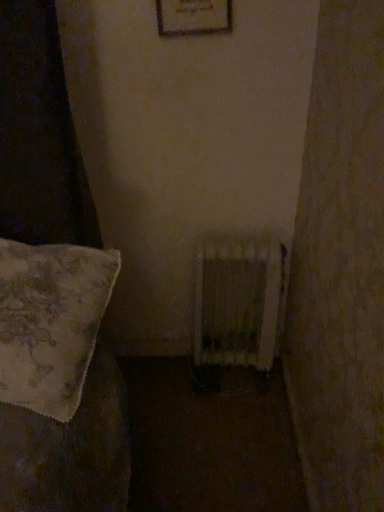
This screenshot has height=512, width=384. What do you see at coordinates (59, 383) in the screenshot? I see `floral fabric pillow at left` at bounding box center [59, 383].

This screenshot has width=384, height=512. Identify the location of wooden framed picture at upper center. (193, 17).

Based on the photo, what is the approximate width of wooden framed picture at upper center?

wooden framed picture at upper center is 3.69 centimeters in width.

Describe the element at coordinates (237, 301) in the screenshot. I see `wooden radiator at center` at that location.

Locate an element on the screen. This screenshot has height=512, width=384. floral fabric pillow at left is located at coordinates (59, 383).

How many degrees apart are the facing directions of floral fabric pillow at left and wooden framed picture at upper center?

There is a 2.29-degree angle between the facing directions of floral fabric pillow at left and wooden framed picture at upper center.

Looking at their sizes, would you say floral fabric pillow at left is wider or thinner than wooden framed picture at upper center?

Clearly, floral fabric pillow at left has more width compared to wooden framed picture at upper center.

Consider the image. Considering the relative positions of floral fabric pillow at left and wooden framed picture at upper center in the image provided, is floral fabric pillow at left to the left or to the right of wooden framed picture at upper center?

Based on their positions, floral fabric pillow at left is located to the left of wooden framed picture at upper center.

Is wooden framed picture at upper center at the back of floral fabric pillow at left?

That's not correct — floral fabric pillow at left is not looking away from wooden framed picture at upper center.

Based on the photo, from a real-world perspective, is wooden framed picture at upper center physically located above or below wooden radiator at center?

In terms of real-world spatial position, wooden framed picture at upper center is above wooden radiator at center.

Is wooden framed picture at upper center inside or outside of wooden radiator at center?

wooden framed picture at upper center lies outside wooden radiator at center.

In the scene shown: Is wooden framed picture at upper center at the left side of wooden radiator at center?

Correct, you'll find wooden framed picture at upper center to the left of wooden radiator at center.

You are a GUI agent. You are given a task and a screenshot of the screen. Output one action in this format:
    pyautogui.click(x=<x>, y=<y>)
    Task: Click on the picture frame above the wooden radiator at center (from the image's perspective)
    
    Given the screenshot: What is the action you would take?
    pyautogui.click(x=193, y=17)

From a real-world perspective, which object rests below the other?

In real-world perspective, wooden radiator at center is lower.

Does wooden radiator at center have a lesser width compared to wooden framed picture at upper center?

In fact, wooden radiator at center might be wider than wooden framed picture at upper center.

Is wooden radiator at center not inside floral fabric pillow at left?

Yes, wooden radiator at center is located beyond the bounds of floral fabric pillow at left.

Between wooden radiator at center and floral fabric pillow at left, which one has less height?

With less height is floral fabric pillow at left.

Which object is further away from the camera taking this photo, wooden radiator at center or floral fabric pillow at left?

wooden radiator at center.

From the image's perspective, is wooden radiator at center above floral fabric pillow at left?

No, from the image's perspective, wooden radiator at center is not over floral fabric pillow at left.

Is floral fabric pillow at left at the back of wooden framed picture at upper center?

No, wooden framed picture at upper center is not facing away from floral fabric pillow at left.

Is wooden framed picture at upper center outside of floral fabric pillow at left?

Absolutely, wooden framed picture at upper center is external to floral fabric pillow at left.

Considering the sizes of objects floral fabric pillow at left and wooden radiator at center in the image provided, who is taller, floral fabric pillow at left or wooden radiator at center?

Standing taller between the two is wooden radiator at center.

How distant is floral fabric pillow at left from wooden radiator at center?

floral fabric pillow at left is 60.10 centimeters from wooden radiator at center.

From the image's perspective, is floral fabric pillow at left located beneath wooden radiator at center?

No.

Looking at their sizes, would you say floral fabric pillow at left is wider or thinner than wooden radiator at center?

Considering their sizes, floral fabric pillow at left looks broader than wooden radiator at center.

You are a GUI agent. You are given a task and a screenshot of the screen. Output one action in this format:
    pyautogui.click(x=<x>, y=<y>)
    Task: Click on the furniture in front of the wooden framed picture at upper center
    This screenshot has height=512, width=384.
    Given the screenshot: What is the action you would take?
    pyautogui.click(x=59, y=383)

Identify the location of picture frame located above the wooden radiator at center (from a real-world perspective). (193, 17).

Estimate the real-world distances between objects in this image. Which object is further from floral fabric pillow at left, wooden radiator at center or wooden framed picture at upper center?

wooden framed picture at upper center is positioned further to the anchor floral fabric pillow at left.

Considering their positions, is wooden radiator at center positioned further to wooden framed picture at upper center than floral fabric pillow at left?

floral fabric pillow at left is further to wooden framed picture at upper center.

When comparing their distances from wooden radiator at center, does wooden framed picture at upper center or floral fabric pillow at left seem closer?

The object closer to wooden radiator at center is floral fabric pillow at left.

When comparing their distances from wooden framed picture at upper center, does floral fabric pillow at left or wooden radiator at center seem further?

The object further to wooden framed picture at upper center is floral fabric pillow at left.

From the image, which object appears to be nearer to floral fabric pillow at left, wooden framed picture at upper center or wooden radiator at center?

The object closer to floral fabric pillow at left is wooden radiator at center.

When comparing their distances from wooden radiator at center, does floral fabric pillow at left or wooden framed picture at upper center seem further?

wooden framed picture at upper center is further to wooden radiator at center.

This screenshot has height=512, width=384. I want to click on furniture between wooden framed picture at upper center and wooden radiator at center in the up-down direction, so click(59, 383).